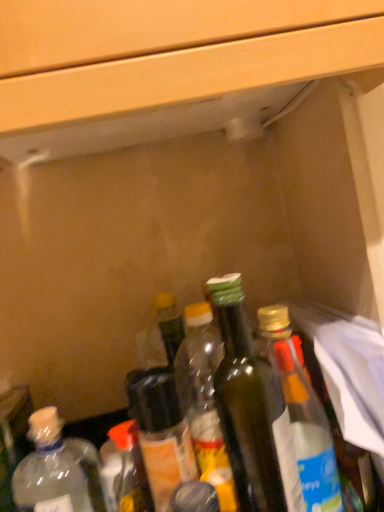
Question: Which direction should I rotate to face clear glass bottle at center, placed as the first bottle when sorted from right to left, — up or down?

Choices:
 (A) down
 (B) up

Answer: (A)

Question: From the image's perspective, would you say translucent plastic bottle at center, the fourth bottle positioned from the right, is shown under clear plastic bottle at lower left, acting as the 1th bottle starting from the left?

Choices:
 (A) yes
 (B) no

Answer: (B)

Question: From a real-world perspective, is translucent plastic bottle at center, the fourth bottle positioned from the right, physically above clear plastic bottle at lower left, acting as the 1th bottle starting from the left?

Choices:
 (A) yes
 (B) no

Answer: (A)

Question: Is translucent plastic bottle at center, the fourth bottle positioned from the right, behind clear plastic bottle at lower left, the 6th bottle in the right-to-left sequence?

Choices:
 (A) yes
 (B) no

Answer: (A)

Question: Is translucent plastic bottle at center, placed as the 3th bottle when sorted from left to right, completely or partially outside of clear plastic bottle at lower left, the 6th bottle in the right-to-left sequence?

Choices:
 (A) yes
 (B) no

Answer: (A)

Question: Would you say translucent plastic bottle at center, placed as the 3th bottle when sorted from left to right, contains clear plastic bottle at lower left, acting as the 1th bottle starting from the left?

Choices:
 (A) yes
 (B) no

Answer: (B)

Question: Is translucent plastic bottle at center, placed as the 3th bottle when sorted from left to right, positioned before clear plastic bottle at lower left, the 6th bottle in the right-to-left sequence?

Choices:
 (A) no
 (B) yes

Answer: (A)

Question: From the image's perspective, is clear glass bottle at center, the sixth bottle in the left-to-right sequence, located above green glass bottle at center, which is the fourth bottle from left to right?

Choices:
 (A) yes
 (B) no

Answer: (A)

Question: Can we say clear glass bottle at center, the sixth bottle in the left-to-right sequence, lies outside green glass bottle at center, the 3th bottle when ordered from right to left?

Choices:
 (A) no
 (B) yes

Answer: (B)

Question: Is clear glass bottle at center, placed as the first bottle when sorted from right to left, positioned behind green glass bottle at center, which is the fourth bottle from left to right?

Choices:
 (A) no
 (B) yes

Answer: (A)

Question: Does clear glass bottle at center, placed as the first bottle when sorted from right to left, appear on the left side of green glass bottle at center, the 3th bottle when ordered from right to left?

Choices:
 (A) yes
 (B) no

Answer: (B)

Question: From a real-world perspective, is clear glass bottle at center, placed as the first bottle when sorted from right to left, over green glass bottle at center, which is the fourth bottle from left to right?

Choices:
 (A) no
 (B) yes

Answer: (A)

Question: From a real-world perspective, is clear glass bottle at center, the sixth bottle in the left-to-right sequence, physically below green glass bottle at center, which is the fourth bottle from left to right?

Choices:
 (A) yes
 (B) no

Answer: (A)

Question: Can you confirm if translucent plastic bottle at center, the fourth bottle positioned from the right, is bigger than green glass bottle at center, which is the fifth bottle in left-to-right order?

Choices:
 (A) no
 (B) yes

Answer: (A)